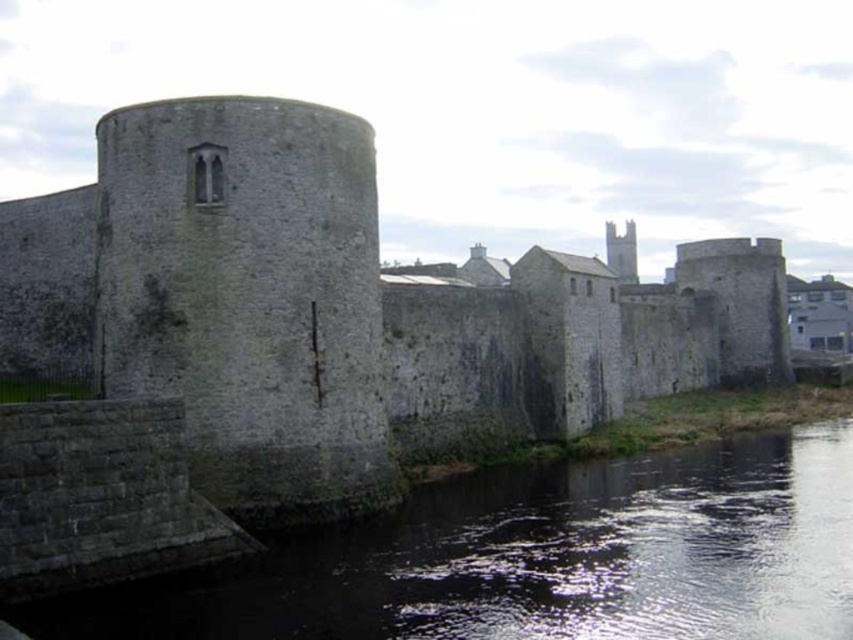
Does stone wall at center have a lesser height compared to dark gray stone river at lower center?

No, stone wall at center is not shorter than dark gray stone river at lower center.

Does stone wall at center have a lesser width compared to dark gray stone river at lower center?

No, stone wall at center is not thinner than dark gray stone river at lower center.

The height and width of the screenshot is (640, 853). In order to click on stone wall at center in this screenshot , I will do `click(305, 340)`.